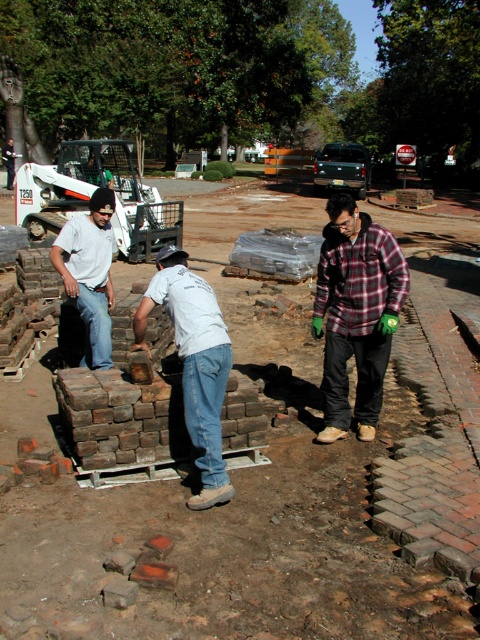
Which of these two, light gray jeans at center or white cotton shirt at left, stands shorter?

With less height is white cotton shirt at left.

At what (x,y) coordinates should I click in order to perform the action: click on light gray jeans at center. Please return your answer as a coordinate pair (x, y). This screenshot has height=640, width=480. Looking at the image, I should click on (193, 364).

Which is behind, point (191, 508) or point (87, 339)?

The point (87, 339) is behind.

This screenshot has height=640, width=480. Find the location of `light gray jeans at center`. light gray jeans at center is located at coordinates (193, 364).

Who is taller, brown brick wall at center or white cotton shirt at left?

Standing taller between the two is brown brick wall at center.

Does point (80, 525) come farther from viewer compared to point (75, 296)?

No, (80, 525) is closer to viewer.

This screenshot has width=480, height=640. What are the coordinates of `brown brick wall at center` in the screenshot? It's located at (239, 520).

Is plaid flannel shirt at center thinner than white cotton shirt at left?

In fact, plaid flannel shirt at center might be wider than white cotton shirt at left.

Can you confirm if plaid flannel shirt at center is positioned below white cotton shirt at left?

Yes, plaid flannel shirt at center is below white cotton shirt at left.

Which is in front, point (336, 433) or point (106, 282)?

Point (336, 433)

You are a GUI agent. You are given a task and a screenshot of the screen. Output one action in this format:
    pyautogui.click(x=<x>, y=<y>)
    Task: Click on the plaid flannel shirt at center
    The width and height of the screenshot is (480, 640).
    Given the screenshot: What is the action you would take?
    pyautogui.click(x=356, y=314)